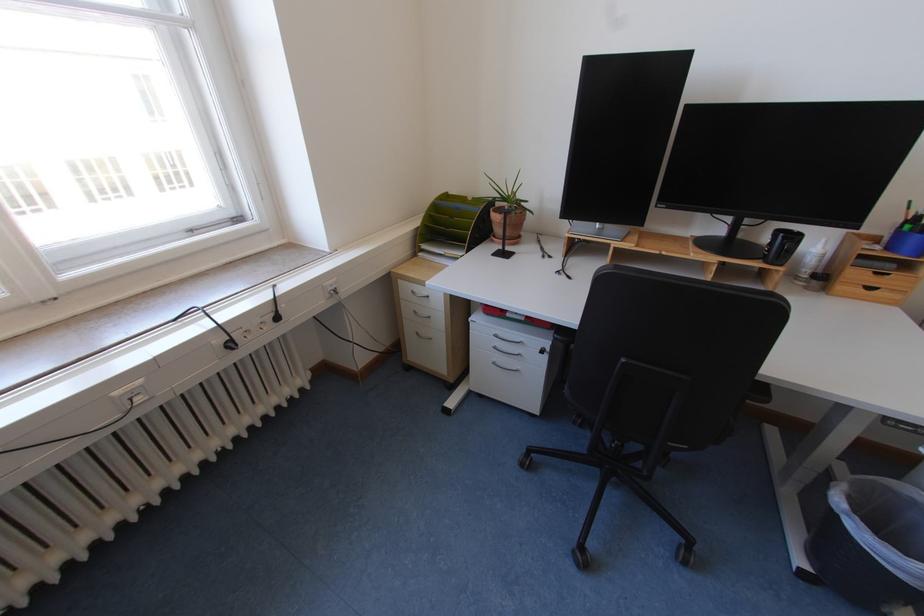
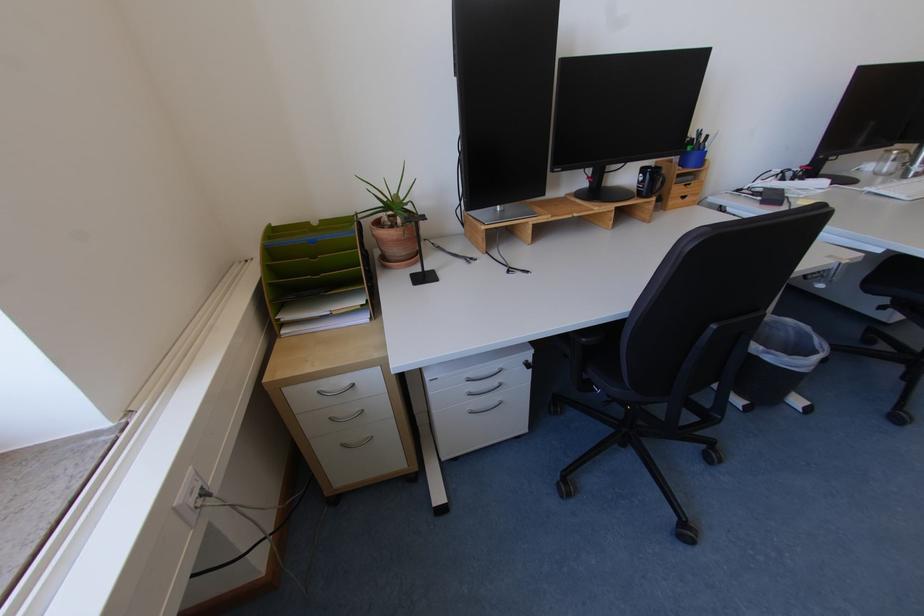
In the second image, find the point that corresponds to pixel 503 361 in the first image.

(477, 410)